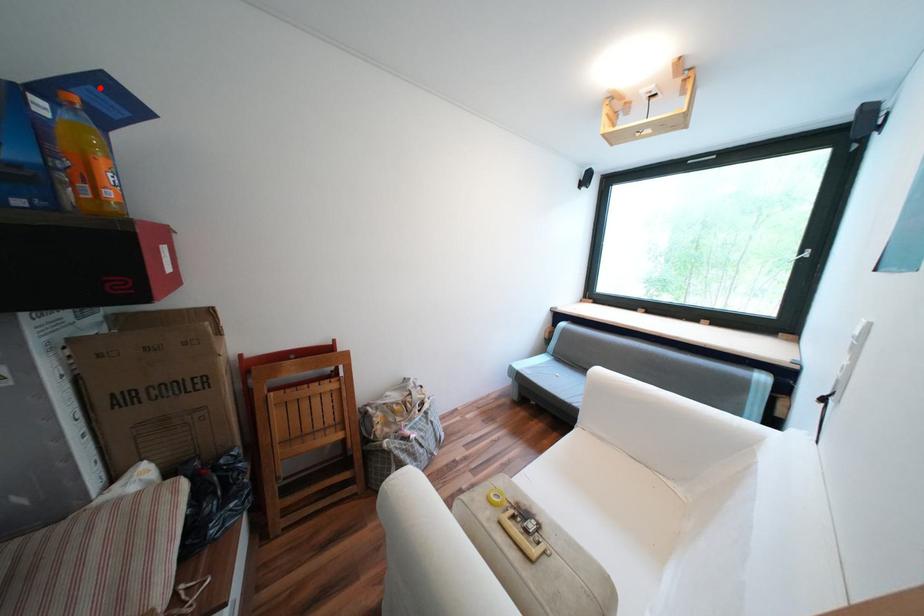
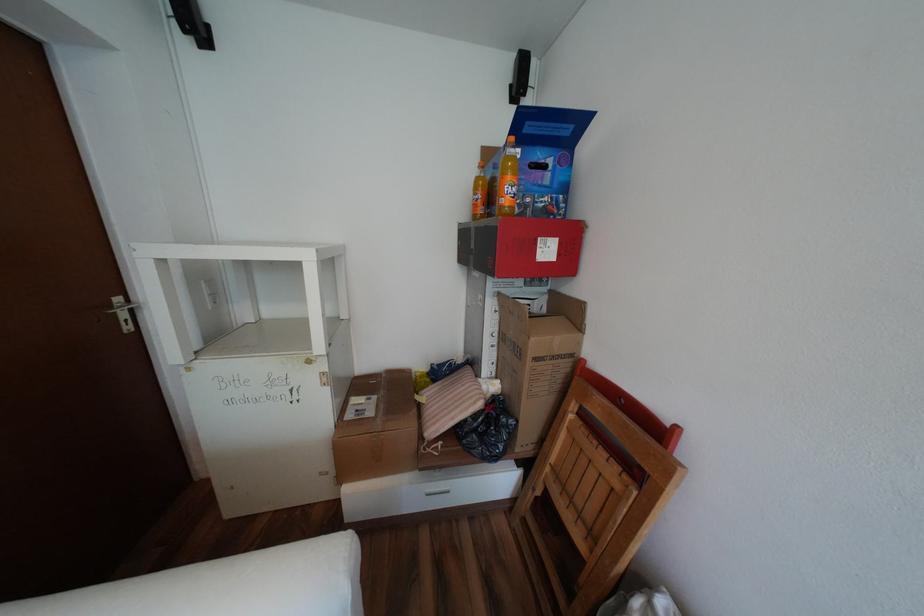
Where in the second image is the point corresponding to the highlighted location from the first image?

(537, 123)